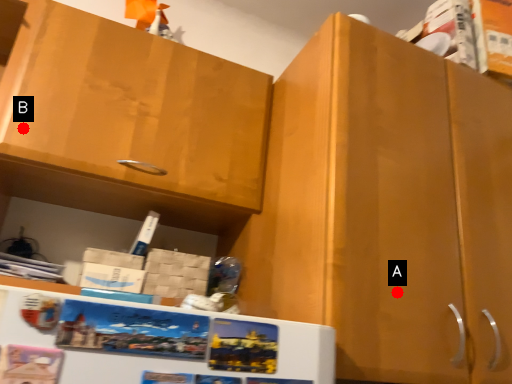
Question: Two points are circled on the image, labeled by A and B beside each circle. Which point is farther from the camera taking this photo?

Choices:
 (A) A is further
 (B) B is further

Answer: (B)